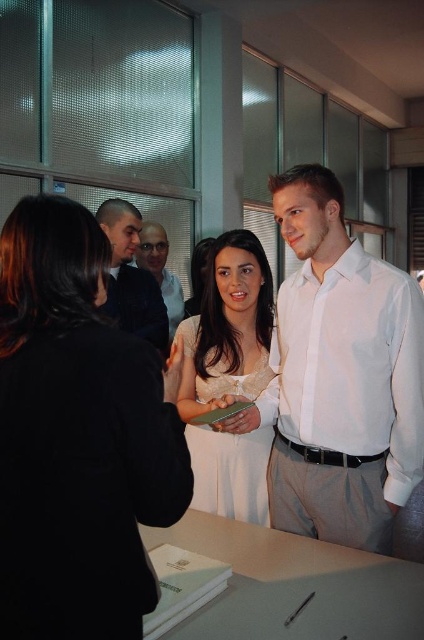
Is white satin dress at center above white satin shirt at upper right?

Actually, white satin dress at center is below white satin shirt at upper right.

Find the location of a particular element. This screenshot has width=424, height=640. white satin dress at center is located at coordinates (77, 436).

Does white satin shirt at upper right appear on the right side of white lace dress at center?

Correct, you'll find white satin shirt at upper right to the right of white lace dress at center.

Measure the distance from white satin shirt at upper right to white lace dress at center.

white satin shirt at upper right and white lace dress at center are 9.82 inches apart.

Is point (301, 280) farther from viewer compared to point (248, 266)?

No, (301, 280) is closer to viewer.

Locate an element on the screen. white satin shirt at upper right is located at coordinates (343, 376).

Who is more distant from viewer, (259, 451) or (161, 250)?

Point (161, 250)

Who is more forward, (237, 468) or (173, 305)?

Point (237, 468) is in front.

Between point (223, 360) and point (166, 237), which one is positioned behind?

Point (166, 237)

Where is `white lace dress at center`? Image resolution: width=424 pixels, height=640 pixels. white lace dress at center is located at coordinates (228, 326).